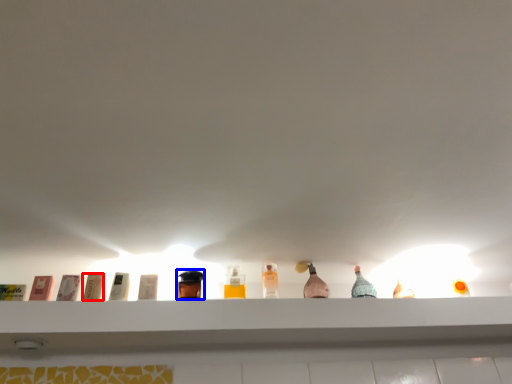
Question: Which object appears farthest to the camera in this image, toiletry (highlighted by a red box) or toiletry (highlighted by a blue box)?

Choices:
 (A) toiletry
 (B) toiletry

Answer: (B)